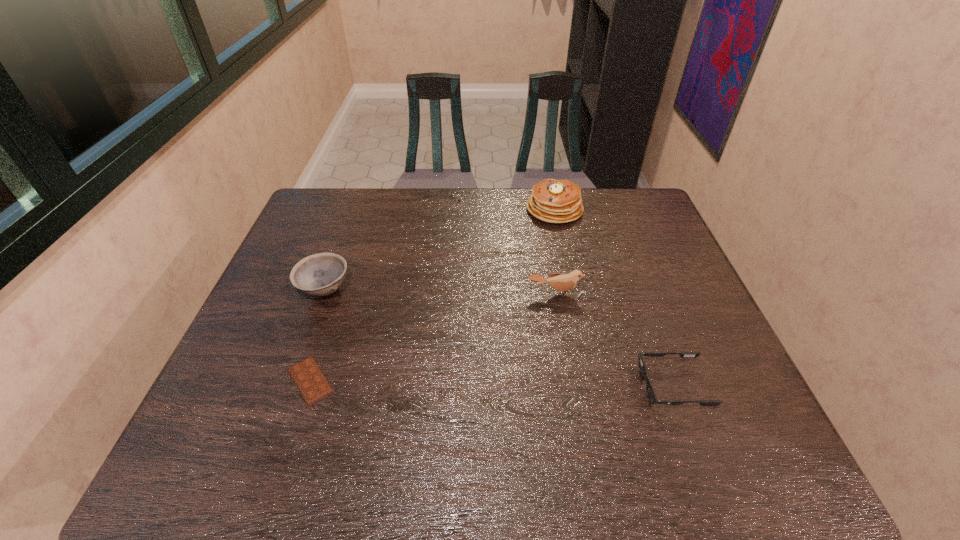
This screenshot has height=540, width=960. In the image, there is a desktop. What are the coordinates of `vacant space at the right edge` in the screenshot? It's located at (708, 358).

In the image, there is a desktop. Where is `vacant space at the far left corner`? vacant space at the far left corner is located at coordinates (329, 193).

The height and width of the screenshot is (540, 960). Identify the location of free region at the far right corner of the desktop. (638, 200).

What are the coordinates of `vacant point located between the bowl and the chocolate bar` in the screenshot? It's located at (318, 335).

This screenshot has width=960, height=540. I want to click on blank region between the sunglasses and the bowl, so click(x=499, y=338).

Find the location of a particular element. This screenshot has height=540, width=960. unoccupied area between the chocolate bar and the pancake is located at coordinates (432, 295).

Locate an element on the screen. The image size is (960, 540). unoccupied position between the farthest object and the chocolate bar is located at coordinates (432, 295).

At what (x,y) coordinates should I click in order to perform the action: click on vacant point located between the pancake and the bird. Please return your answer as a coordinate pair (x, y). Image resolution: width=960 pixels, height=540 pixels. Looking at the image, I should click on (555, 251).

Where is `free area in between the shortest object and the pancake`? Image resolution: width=960 pixels, height=540 pixels. free area in between the shortest object and the pancake is located at coordinates (432, 295).

The width and height of the screenshot is (960, 540). Identify the location of free point between the bowl and the bird. (441, 292).